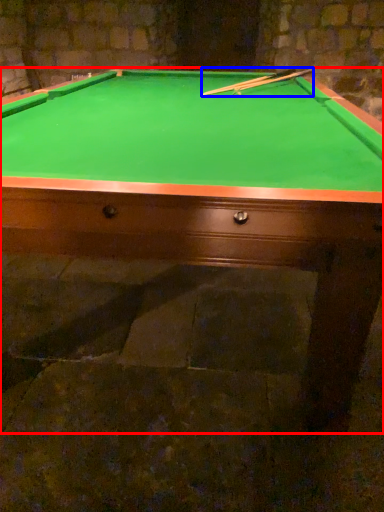
Question: Which object is further to the camera taking this photo, billiard table (highlighted by a red box) or cue (highlighted by a blue box)?

Choices:
 (A) billiard table
 (B) cue

Answer: (B)